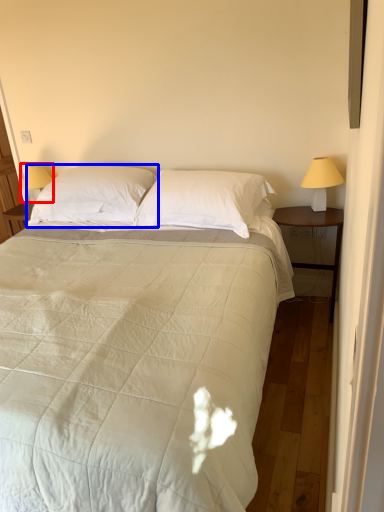
Question: Among these objects, which one is farthest to the camera, table lamp (highlighted by a red box) or pillow (highlighted by a blue box)?

Choices:
 (A) table lamp
 (B) pillow

Answer: (A)